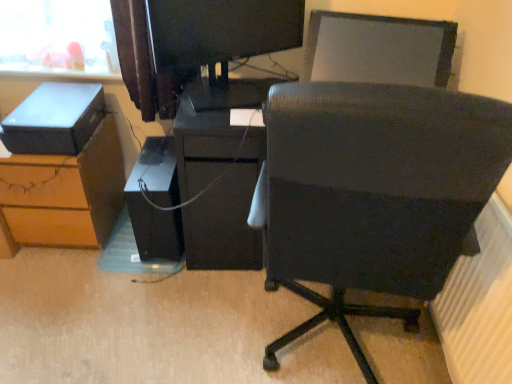
The height and width of the screenshot is (384, 512). I want to click on blank area to the left of white textured radiator at lower right, so click(370, 352).